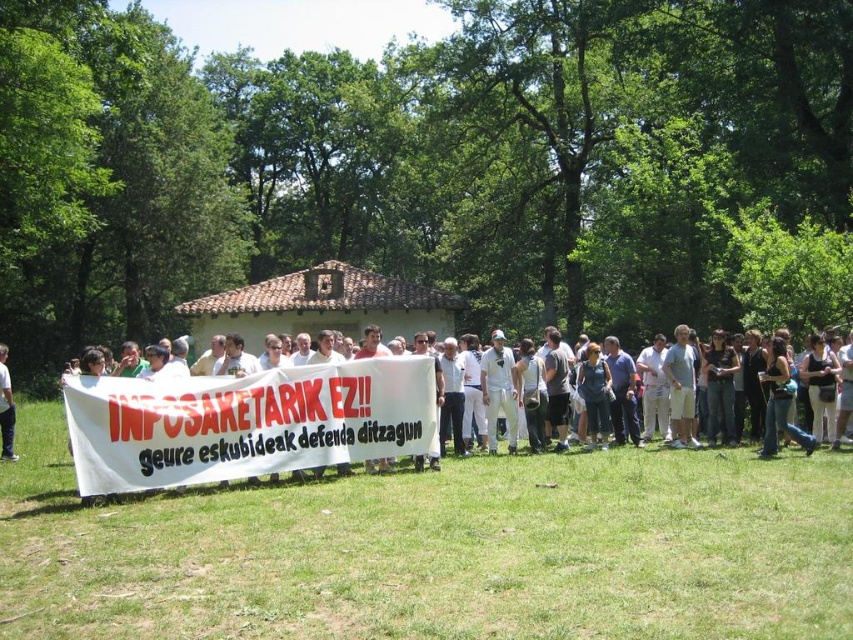
Question: Among these objects, which one is nearest to the camera?

Choices:
 (A) white cotton shirt at lower left
 (B) white cloth banner at center

Answer: (B)

Question: Can you confirm if white cloth banner at center is smaller than white cotton shirt at lower left?

Choices:
 (A) yes
 (B) no

Answer: (B)

Question: Does white cloth banner at center appear over white cotton shirt at lower left?

Choices:
 (A) yes
 (B) no

Answer: (A)

Question: Which point is farther to the camera?

Choices:
 (A) (4, 376)
 (B) (386, 449)

Answer: (A)

Question: Is white cloth banner at center further to the viewer compared to white cotton shirt at lower left?

Choices:
 (A) yes
 (B) no

Answer: (B)

Question: Which of the following is the closest to the observer?

Choices:
 (A) (148, 392)
 (B) (1, 344)

Answer: (A)